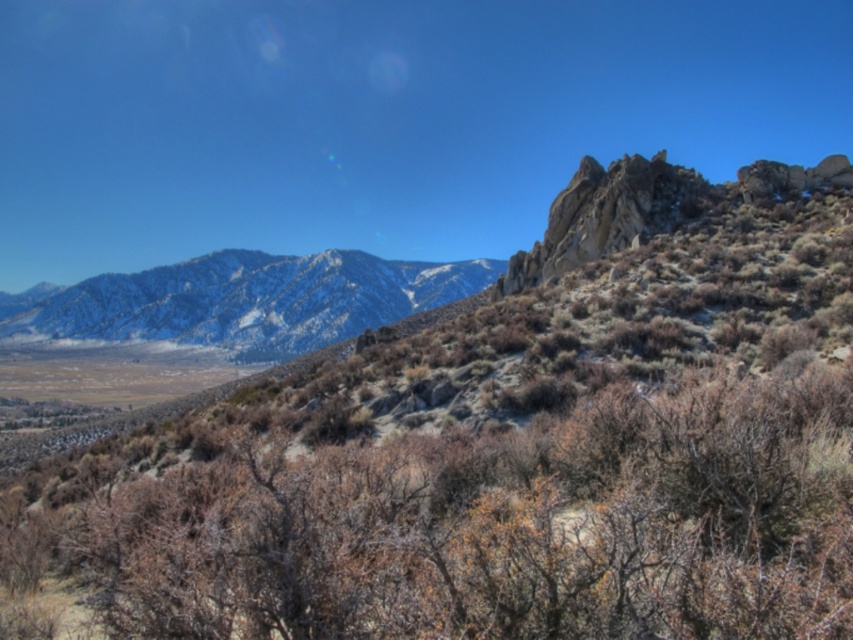
Consider the image. Between brown textured shrub at center and snowy rocky mountain range at upper left, which one has more height?

Standing taller between the two is snowy rocky mountain range at upper left.

Can you confirm if brown textured shrub at center is thinner than snowy rocky mountain range at upper left?

Correct, brown textured shrub at center's width is less than snowy rocky mountain range at upper left's.

Does point (555, 480) come in front of point (419, 273)?

Yes, it is in front of point (419, 273).

In order to click on brown textured shrub at center in this screenshot , I will do `click(471, 522)`.